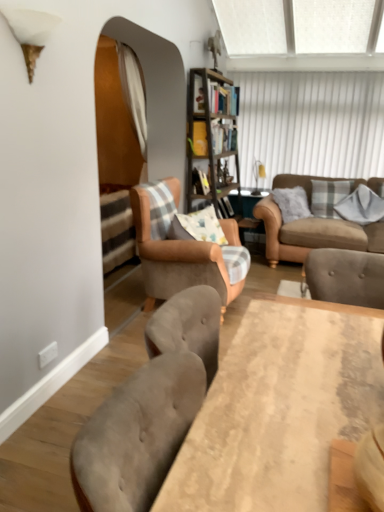
This screenshot has height=512, width=384. What are the coordinates of `blank space situated above white textured window screen at upper center (from a real-world perspective)` in the screenshot? It's located at (311, 67).